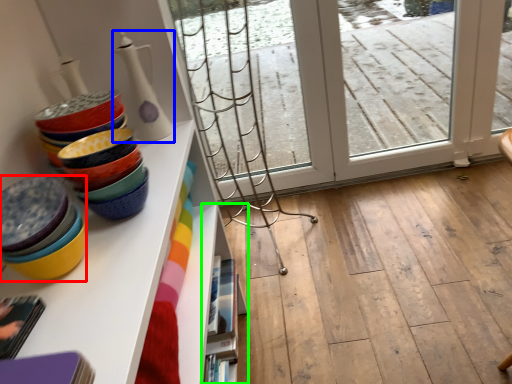
Question: Which is nearer to the table (highlighted by a red box)? tableware (highlighted by a blue box) or shelf (highlighted by a green box).

Choices:
 (A) tableware
 (B) shelf

Answer: (A)